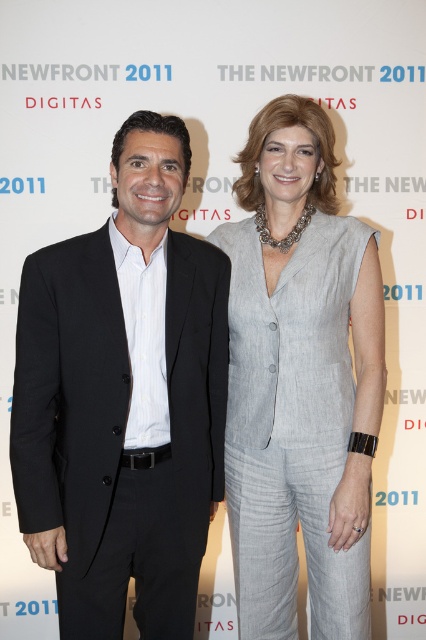
Question: Does black smooth suit at left have a smaller size compared to light gray linen suit at center?

Choices:
 (A) yes
 (B) no

Answer: (B)

Question: Does black smooth suit at left have a greater width compared to light gray linen suit at center?

Choices:
 (A) no
 (B) yes

Answer: (B)

Question: Among these objects, which one is nearest to the camera?

Choices:
 (A) light gray linen suit at center
 (B) black smooth suit at left

Answer: (B)

Question: Which of the following is the closest to the observer?

Choices:
 (A) black smooth suit at left
 (B) light gray linen suit at center

Answer: (A)

Question: Is black smooth suit at left behind light gray linen suit at center?

Choices:
 (A) yes
 (B) no

Answer: (B)